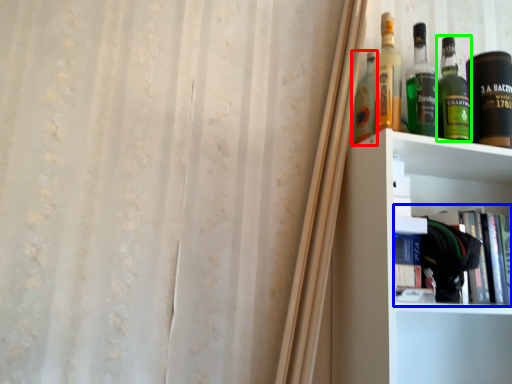
Question: Which object is the closest to the bottle (highlighted by a red box)? Choose among these: book (highlighted by a blue box) or bottle (highlighted by a green box).

Choices:
 (A) book
 (B) bottle

Answer: (B)